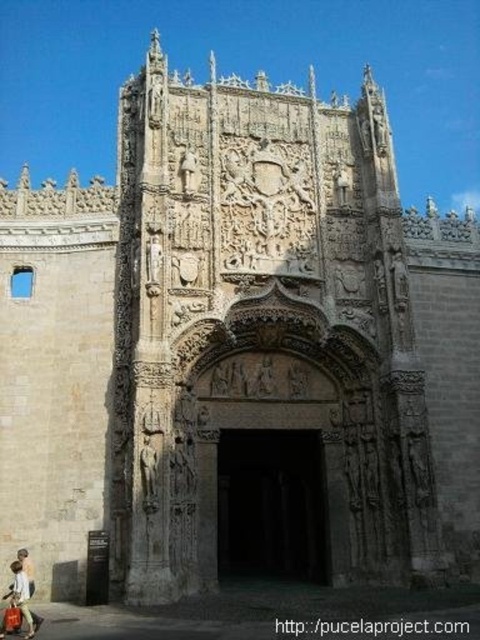
Question: Is the position of dark stone archway at center more distant than that of matte beige coat at lower left?

Choices:
 (A) no
 (B) yes

Answer: (B)

Question: Which point appears closest to the camera in this image?

Choices:
 (A) (27, 637)
 (B) (315, 438)

Answer: (A)

Question: Which point is closer to the camera?

Choices:
 (A) (322, 448)
 (B) (31, 630)

Answer: (B)

Question: Can you confirm if dark stone archway at center is thinner than matte beige coat at lower left?

Choices:
 (A) no
 (B) yes

Answer: (A)

Question: Is dark stone archway at center to the right of matte beige coat at lower left from the viewer's perspective?

Choices:
 (A) yes
 (B) no

Answer: (A)